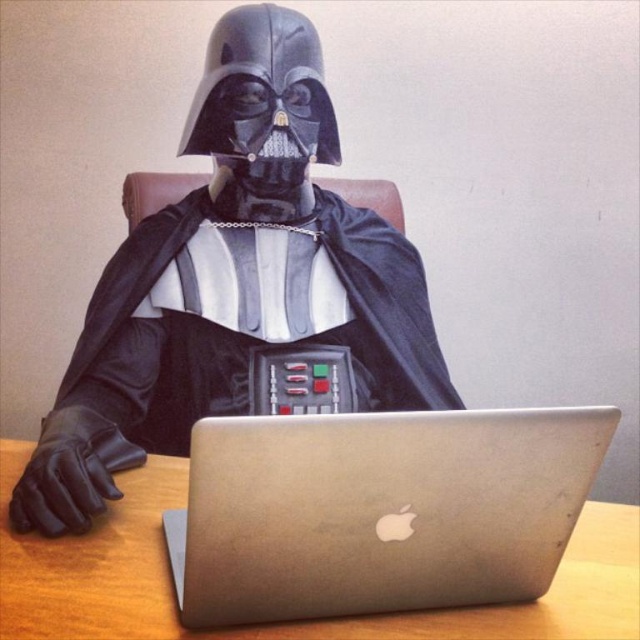
Looking at this image, you are a photographer setting up for a photoshoot. You need to ensure that the metallic silver laptop at center is visible in the frame without being blocked by the black matte robe at center. Based on the scene description, is the laptop currently visible?

The metallic silver laptop at center is positioned under the black matte robe at center, so it is currently blocked and not visible in the frame.

What are the exact coordinates of the silver metallic laptop at center in the image?

The silver metallic laptop at center is located at point (x=378, y=509).

You are a photographer setting up for a photoshoot. The subject is wearing a Darth Vader costume and has a MacBook in front of them. You need to ensure there is at least 3 centimeters of space between the metallic silver laptop at center and the black matte robe at center for proper lighting. Based on the scene description, is the current spacing sufficient?

The metallic silver laptop at center is 2.02 centimeters away from the black matte robe at center. Since the required spacing is 3 centimeters, the current distance is insufficient. The photographer needs to adjust the positioning to create more space between the metallic silver laptop at center and the black matte robe at center.